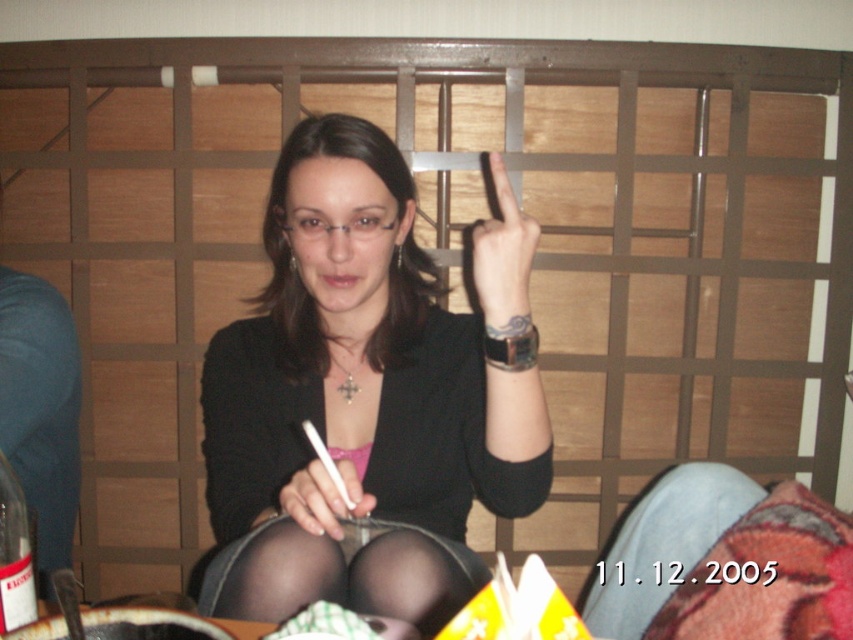
What is the exact coordinate of the denim at lower right?

The denim at lower right is located at point [662,545].